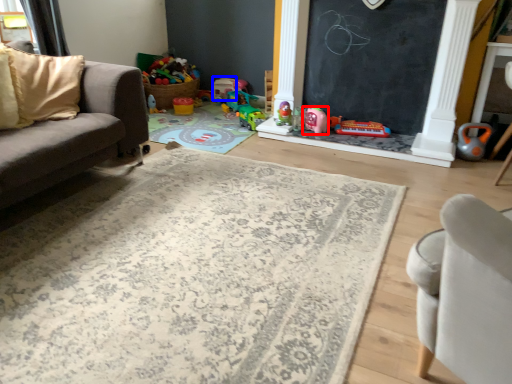
Question: Which point is closer to the camera, toy (highlighted by a red box) or toy (highlighted by a blue box)?

Choices:
 (A) toy
 (B) toy

Answer: (A)